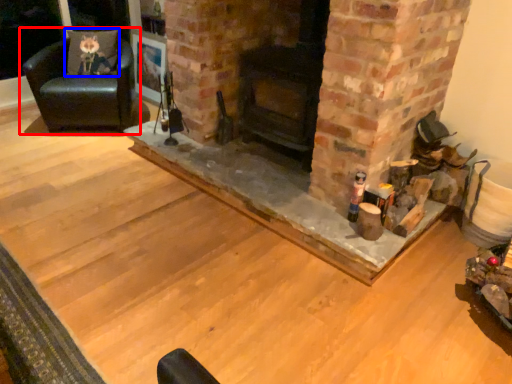
Question: Among these objects, which one is nearest to the camera, chair (highlighted by a red box) or pillow (highlighted by a blue box)?

Choices:
 (A) chair
 (B) pillow

Answer: (A)